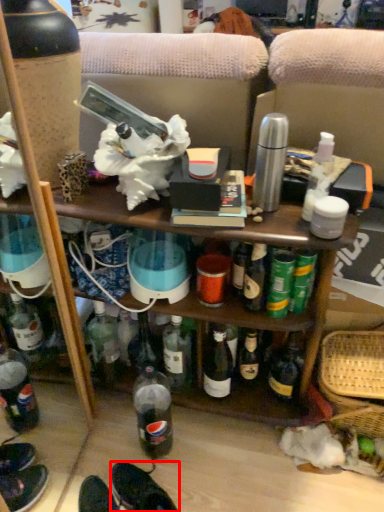
Question: Considering the relative positions of footwear (annotated by the red box) and basket in the image provided, where is footwear (annotated by the red box) located with respect to the staircase?

Choices:
 (A) left
 (B) right

Answer: (A)